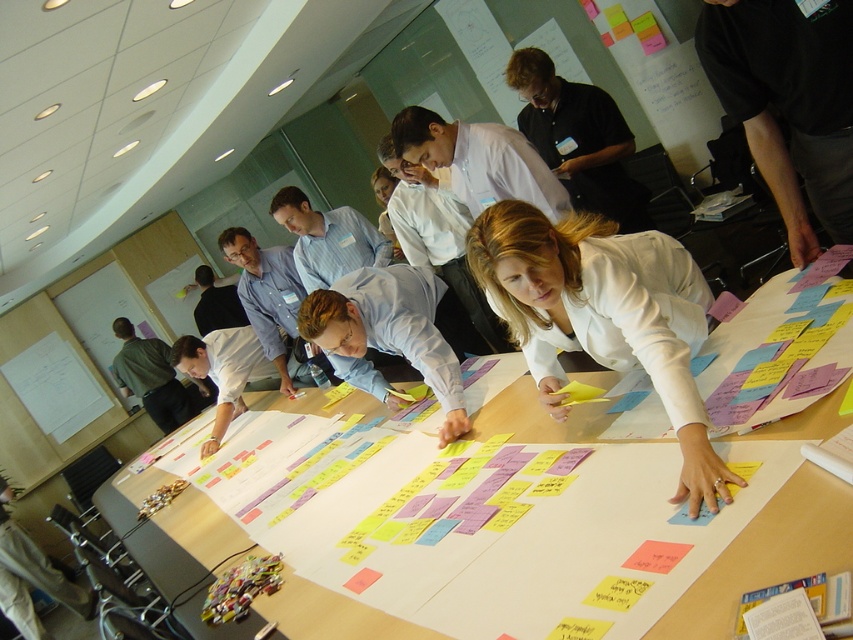
You are an office assistant who needs to place a new folder on the table. The folder is the same size as the white paper at center. Will the folder fit under the black shirt at upper center?

The white paper at center is smaller than the black shirt at upper center. Since the folder is the same size as the white paper at center, it will fit under the black shirt at upper center because it is smaller in size.

In the scene shown: You are a photographer positioned at the entrance of the room. You need to take a photo of the white matte shirt at center and the black shirt at upper center. Which one will appear closer to the camera in the final photo?

The white matte shirt at center will appear closer to the camera in the final photo because it is in front of the black shirt at upper center.